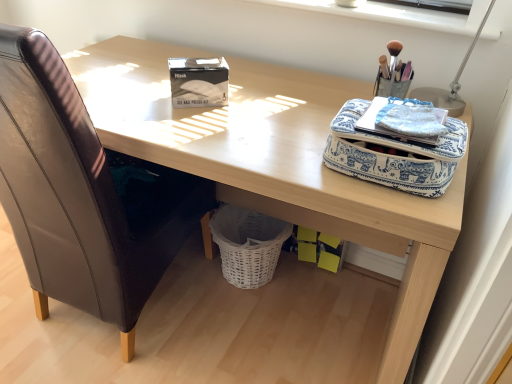
Question: Is metallic silver table lamp at upper right bigger or smaller than white plastic at upper center?

Choices:
 (A) small
 (B) big

Answer: (B)

Question: From the image's perspective, relative to white plastic at upper center, is metallic silver table lamp at upper right above or below?

Choices:
 (A) below
 (B) above

Answer: (A)

Question: Considering the real-world distances, which object is farthest from the white plastic at upper center?

Choices:
 (A) metallic silver table lamp at upper right
 (B) brown leather chair at left
 (C) white matte gel nail polish kit at upper center
 (D) white wicker basket at lower center
 (E) blue printed fabric bag at upper right

Answer: (B)

Question: Estimate the real-world distances between objects in this image. Which object is closer to the brown leather chair at left?

Choices:
 (A) white matte gel nail polish kit at upper center
 (B) wooden desk at center
 (C) blue printed fabric bag at upper right
 (D) white wicker basket at lower center
 (E) metallic silver table lamp at upper right

Answer: (B)